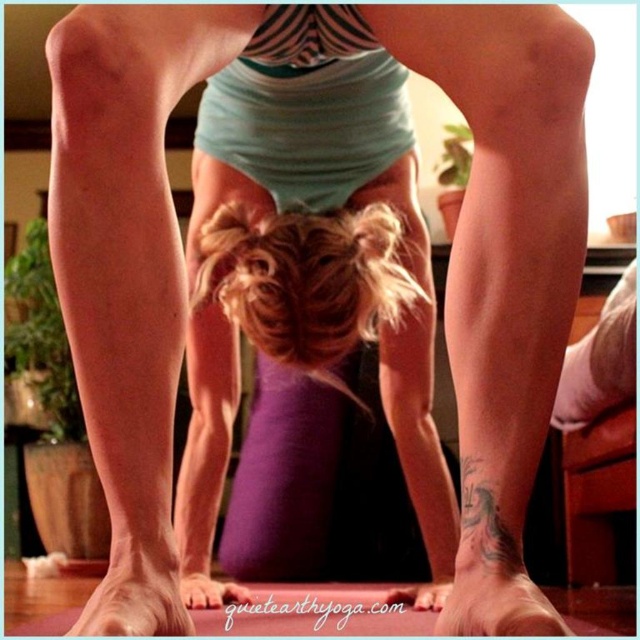
Between point (337, 385) and point (442, 609), which one is positioned behind?

Point (337, 385)

Who is higher up, blonde hair at center or smooth skin foot at lower center?

Positioned higher is blonde hair at center.

Who is more distant from viewer, (232, 301) or (540, 600)?

Point (232, 301)

The image size is (640, 640). Find the location of `blonde hair at center`. blonde hair at center is located at coordinates (308, 276).

Does blonde hair at center have a lesser width compared to smooth skin leg at lower center?

Incorrect, blonde hair at center's width is not less than smooth skin leg at lower center's.

Can you confirm if blonde hair at center is shorter than smooth skin leg at lower center?

No, blonde hair at center is not shorter than smooth skin leg at lower center.

Identify the location of blonde hair at center. (308, 276).

Find the location of a particular element. blonde hair at center is located at coordinates (308, 276).

Does smooth skin leg at lower center come in front of smooth skin leg at lower left?

Yes, it is in front of smooth skin leg at lower left.

Is smooth skin leg at lower center to the right of smooth skin leg at lower left from the viewer's perspective?

Indeed, smooth skin leg at lower center is positioned on the right side of smooth skin leg at lower left.

Between point (563, 106) and point (81, 144), which one is positioned behind?

Positioned behind is point (563, 106).

Where is `smooth skin leg at lower center`? smooth skin leg at lower center is located at coordinates (504, 273).